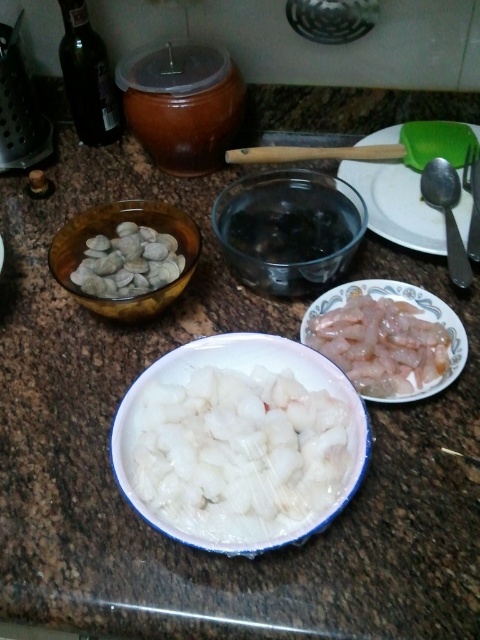
You are preparing a seafood dish and need to place the translucent white shrimp at right into the transparent glass bowl at center. Can the shrimp fit inside the bowl?

The transparent glass bowl at center is larger in size than the translucent white shrimp at right, so the shrimp can fit inside the bowl.

You are standing in front of the kitchen countertop and want to place a small spice jar between the two points marked as point (292, 272) and point (92, 269). Can you determine which point is closer to you to help position the jar correctly?

Point (292, 272) is closer to the camera than point (92, 269), so you should position the spice jar closer to point (292, 272) to ensure proper placement.

From the picture: You are standing in front of the kitchen countertop and want to reach the point at coordinates point (271, 237). The countertop has a depth of 24 inches. Is the point within the countertop area?

The point (271, 237) is 28.22 inches from the viewer, which is beyond the countertop depth of 24 inches. Therefore, the point is outside the countertop area.